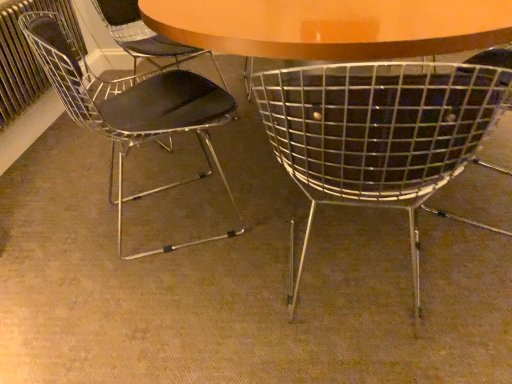
The image size is (512, 384). I want to click on vacant space behind metal mesh chair at center, which is the second chair in left-to-right order, so click(295, 203).